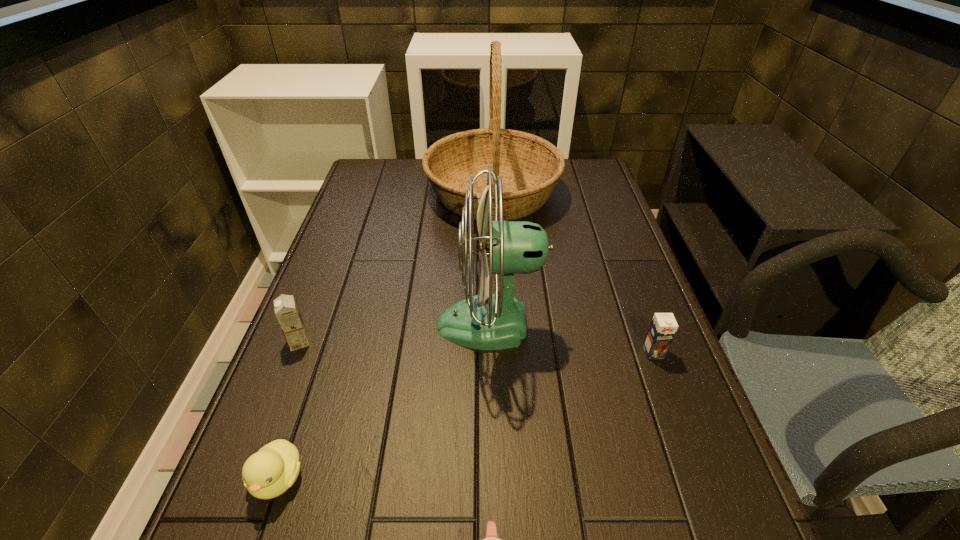
You are a GUI agent. You are given a task and a screenshot of the screen. Output one action in this format:
    pyautogui.click(x=<x>, y=<y>)
    Task: Click on the basket
    This screenshot has height=540, width=960.
    Given the screenshot: What is the action you would take?
    (x=530, y=166)

Find the location of a particular element. This screenshot has height=540, width=960. fan is located at coordinates (488, 321).

You are a GUI agent. You are given a task and a screenshot of the screen. Output one action in this format:
    pyautogui.click(x=<x>, y=<y>)
    Task: Click on the left chocolate milk
    This screenshot has height=540, width=960.
    Given the screenshot: What is the action you would take?
    pyautogui.click(x=286, y=310)

The image size is (960, 540). I want to click on the third shortest object, so click(x=663, y=327).

You are a GUI agent. You are given a task and a screenshot of the screen. Output one action in this format:
    pyautogui.click(x=<x>, y=<y>)
    Task: Click on the shorter chocolate milk
    
    Given the screenshot: What is the action you would take?
    pyautogui.click(x=663, y=327)

Find the location of a particular element. This screenshot has width=960, height=540. duckling is located at coordinates (268, 473).

The image size is (960, 540). What are the coordinates of `vacant region located 0.310m on the front of the farthest object` in the screenshot? It's located at (497, 313).

Where is `free space located 0.290m in front of the second tallest object, directing airflow`? free space located 0.290m in front of the second tallest object, directing airflow is located at coordinates (311, 325).

You are a GUI agent. You are given a task and a screenshot of the screen. Output one action in this format:
    pyautogui.click(x=<x>, y=<y>)
    Task: Click on the blank space located in front of the second tallest object, directing airflow
    This screenshot has width=960, height=540.
    Given the screenshot: What is the action you would take?
    pyautogui.click(x=311, y=325)

Find the location of a particular element. This screenshot has width=960, height=540. vacant area situated in front of the second tallest object, directing airflow is located at coordinates (328, 325).